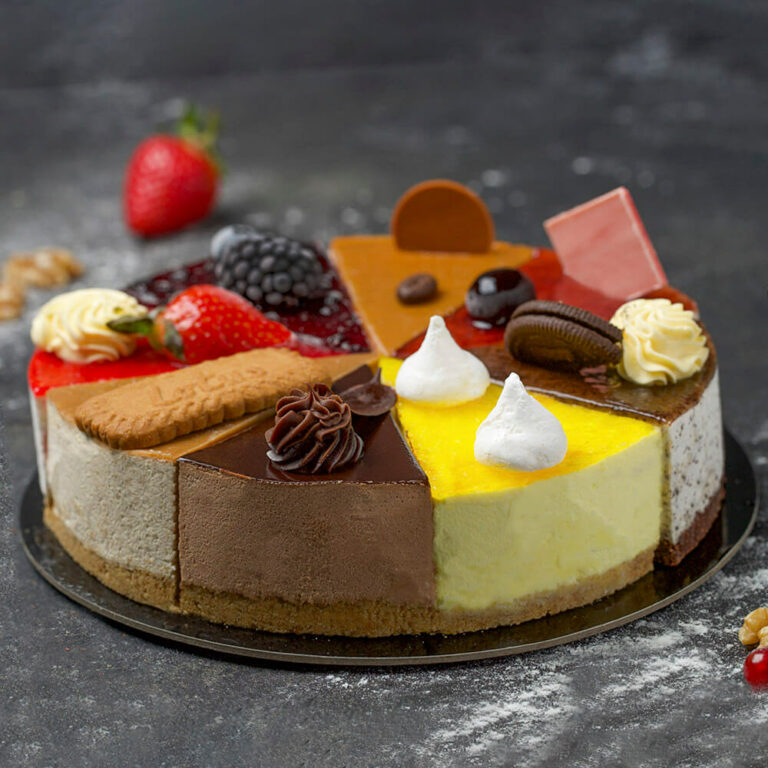
Find the location of a particular element. The width and height of the screenshot is (768, 768). forks not in image is located at coordinates (684, 275), (706, 270), (730, 270), (750, 267).